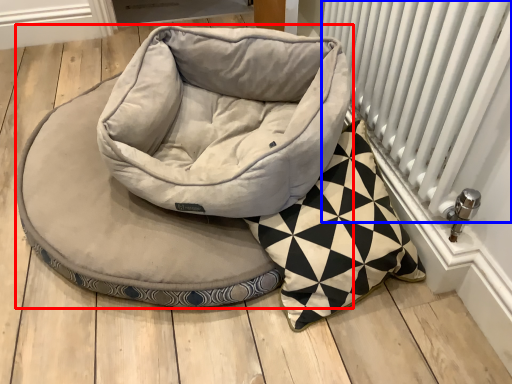
Question: Which object is closer to the camera taking this photo, dog bed (highlighted by a red box) or radiator (highlighted by a blue box)?

Choices:
 (A) dog bed
 (B) radiator

Answer: (B)